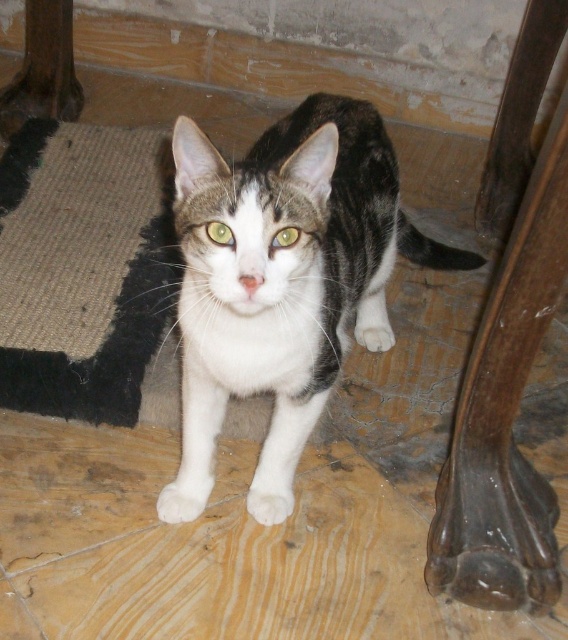
You are a robotic vacuum cleaner with a 16 inch diameter. You are currently positioned at the sisal carpet at lower left and want to reach the white fur cat at center to clean around it. Can you move directly towards the cat without needing to turn?

The distance between the white fur cat at center and the sisal carpet at lower left is 17.24 inches. Since the robotic vacuum cleaner has a 16 inch diameter, it can move straight towards the cat as the distance is greater than its size, allowing it to reach the area near the cat without needing to turn.

You are trying to determine if a small toy that is 15 inches long can fit entirely on the sisal carpet at lower left without overlapping the white fur cat at center. Based on their widths, can the toy fit?

The white fur cat at center is wider than the sisal carpet at lower left. Since the cat is wider, the sisal carpet at lower left might not have enough space to accommodate the 15 inch toy without overlapping the cat.

You are a photographer setting up a studio for a pet photoshoot. You have a white fur cat at center and a sisal carpet at lower left. The cat needs to be positioned in such a way that it doesn t overwhelm the composition. Since the cat is larger than the sisal carpet, where should you place the cat to ensure the carpet remains a subtle part of the background?

Since the white fur cat at center is bigger than the sisal carpet at lower left, positioning the cat closer to the foreground while placing the sisal carpet at lower left further back can help maintain its subtlety in the background.